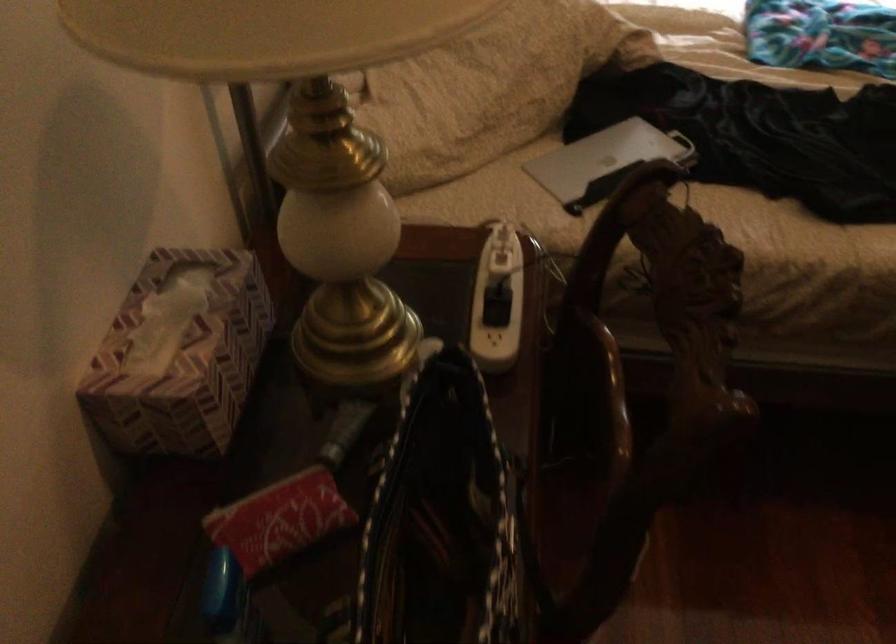
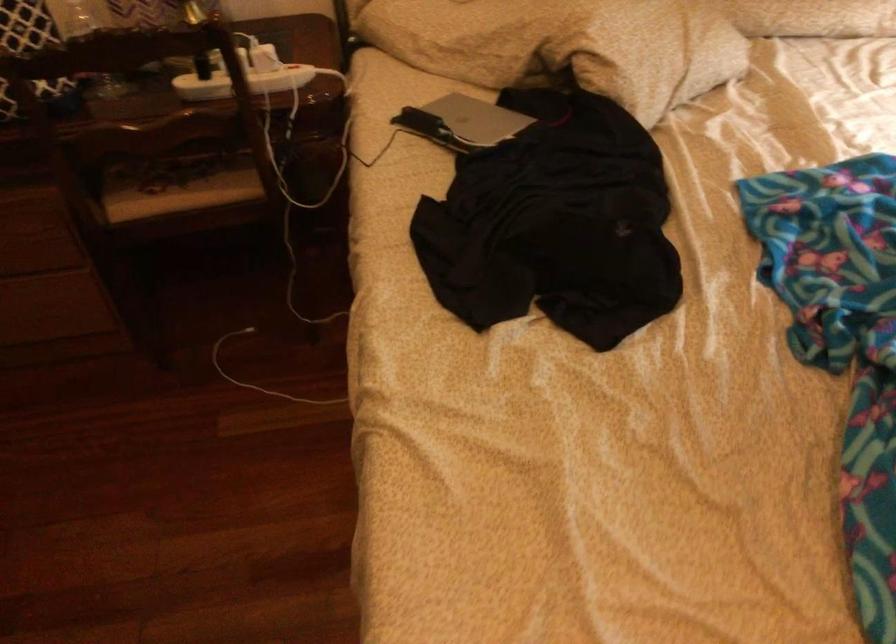
The point at (615, 151) is marked in the first image. Where is the corresponding point in the second image?

(477, 118)